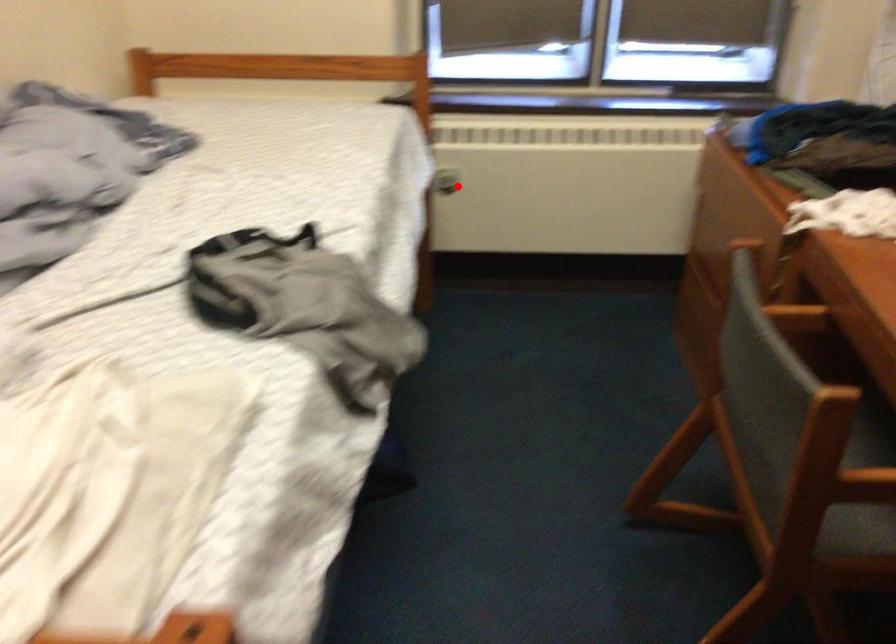
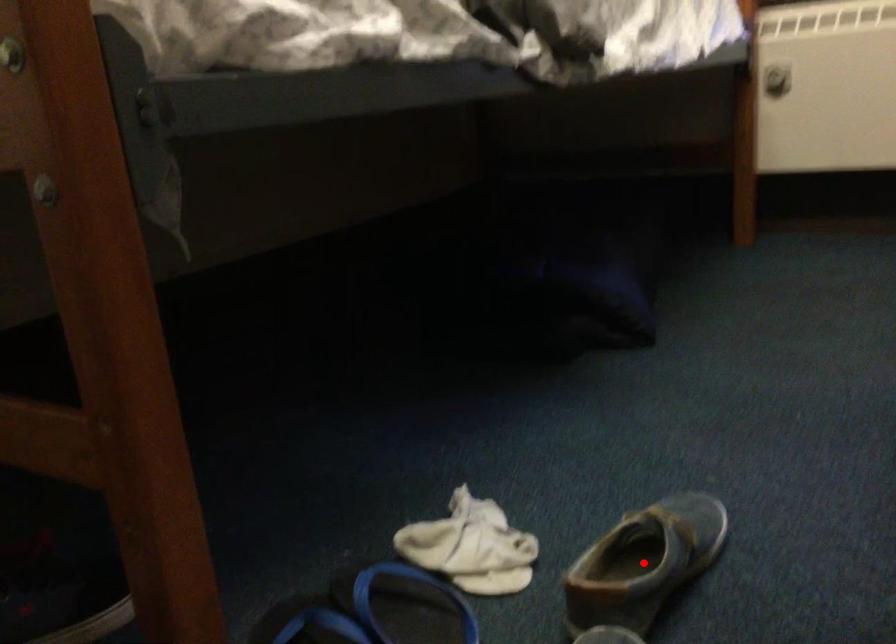
I am providing you with two images of the same scene from different viewpoints. A red point is marked on the first image and another point is marked on the second image. Is the marked point in image1 the same physical position as the marked point in image2?

No